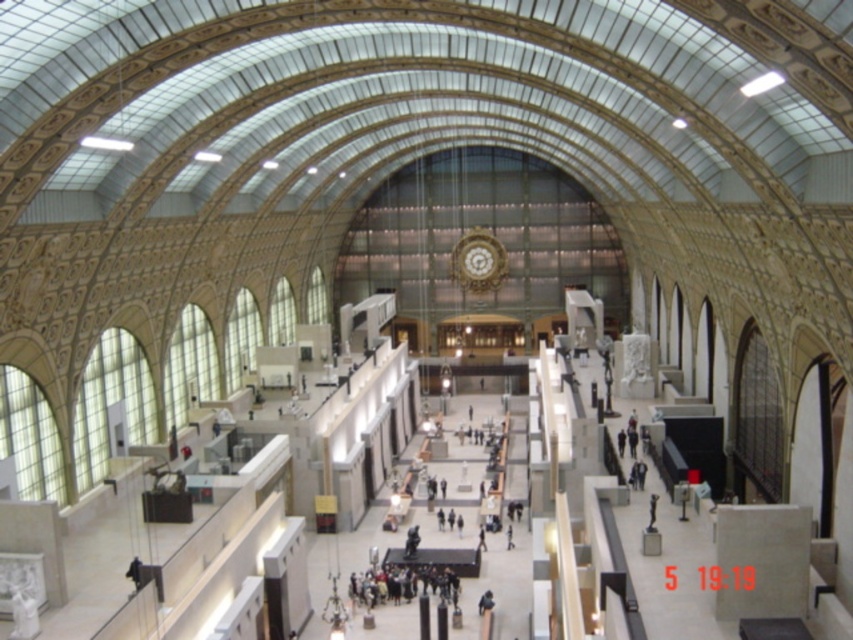
Question: Among these objects, which one is farthest from the camera?

Choices:
 (A) dark gray fabric group at center
 (B) gold textured clock at center

Answer: (B)

Question: Is dark gray fabric group at center behind gold textured clock at center?

Choices:
 (A) yes
 (B) no

Answer: (B)

Question: Does dark gray fabric group at center have a smaller size compared to gold textured clock at center?

Choices:
 (A) no
 (B) yes

Answer: (B)

Question: Which point is farther to the camera?

Choices:
 (A) dark gray fabric group at center
 (B) gold textured clock at center

Answer: (B)

Question: Is dark gray fabric group at center positioned at the back of gold textured clock at center?

Choices:
 (A) no
 (B) yes

Answer: (A)